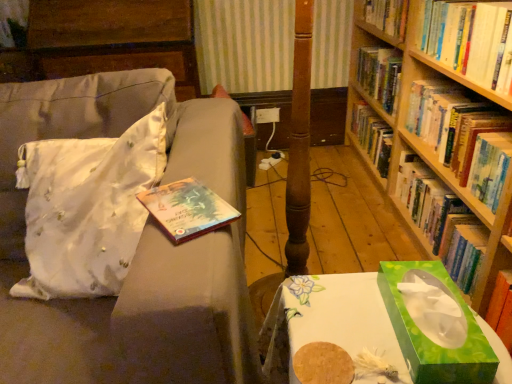
Question: Can you confirm if white satin throw pillow at left is positioned to the right of white glossy table at lower right?

Choices:
 (A) yes
 (B) no

Answer: (B)

Question: Is the depth of white satin throw pillow at left less than that of white glossy table at lower right?

Choices:
 (A) yes
 (B) no

Answer: (B)

Question: From the image's perspective, is white satin throw pillow at left located above white glossy table at lower right?

Choices:
 (A) no
 (B) yes

Answer: (B)

Question: Could you tell me if white satin throw pillow at left is facing white glossy table at lower right?

Choices:
 (A) no
 (B) yes

Answer: (A)

Question: Is white satin throw pillow at left thinner than white glossy table at lower right?

Choices:
 (A) yes
 (B) no

Answer: (B)

Question: Does white satin throw pillow at left have a smaller size compared to white glossy table at lower right?

Choices:
 (A) no
 (B) yes

Answer: (B)

Question: Does hardcover book at upper right, acting as the 1th book starting from the bottom, have a greater height compared to hardcover book at right, marked as the 2th book in a bottom-to-top arrangement?

Choices:
 (A) no
 (B) yes

Answer: (B)

Question: Is hardcover book at upper right, acting as the 1th book starting from the bottom, to the right of hardcover book at right, marked as the 2th book in a bottom-to-top arrangement, from the viewer's perspective?

Choices:
 (A) no
 (B) yes

Answer: (B)

Question: Is hardcover book at upper right, marked as the 3th book in a top-to-bottom arrangement, wider than hardcover book at right, marked as the 2th book in a bottom-to-top arrangement?

Choices:
 (A) yes
 (B) no

Answer: (A)

Question: Considering the relative sizes of hardcover book at upper right, marked as the 3th book in a top-to-bottom arrangement, and hardcover book at right, marked as the 2th book in a bottom-to-top arrangement, in the image provided, is hardcover book at upper right, marked as the 3th book in a top-to-bottom arrangement, thinner than hardcover book at right, marked as the 2th book in a bottom-to-top arrangement,?

Choices:
 (A) no
 (B) yes

Answer: (A)

Question: Could you tell me if hardcover book at upper right, acting as the 1th book starting from the bottom, is facing hardcover book at right, marked as the 2th book in a bottom-to-top arrangement?

Choices:
 (A) no
 (B) yes

Answer: (A)

Question: From the image's perspective, would you say hardcover book at upper right, marked as the 3th book in a top-to-bottom arrangement, is positioned over hardcover book at right, marked as the 2th book in a bottom-to-top arrangement?

Choices:
 (A) no
 (B) yes

Answer: (A)

Question: Would you say white satin throw pillow at left is part of hardcover book at upper right, which is the third book in bottom-to-top order,'s contents?

Choices:
 (A) yes
 (B) no

Answer: (B)